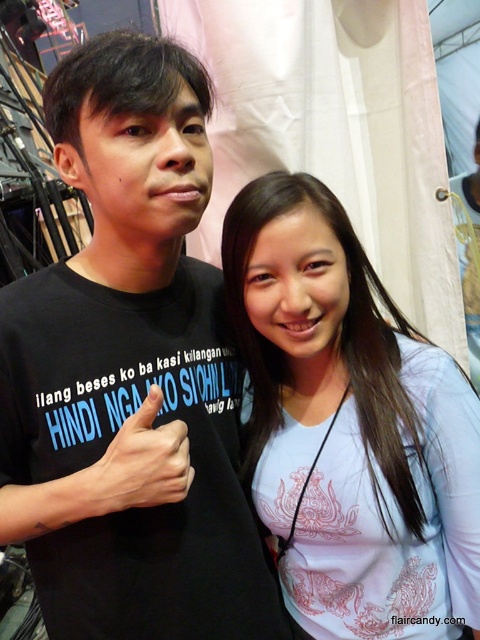
Question: Does black matte t-shirt at center appear on the left side of white matte shirt at center?

Choices:
 (A) yes
 (B) no

Answer: (A)

Question: Estimate the real-world distances between objects in this image. Which object is closer to the white matte shirt at center?

Choices:
 (A) black matte t-shirt at center
 (B) black matte hand at center

Answer: (A)

Question: Among these objects, which one is farthest from the camera?

Choices:
 (A) black matte t-shirt at center
 (B) black matte hand at center
 (C) white matte shirt at center

Answer: (C)

Question: From the image, what is the correct spatial relationship of black matte t-shirt at center in relation to white matte shirt at center?

Choices:
 (A) below
 (B) above

Answer: (B)

Question: Which object is farther from the camera taking this photo?

Choices:
 (A) black matte t-shirt at center
 (B) white matte shirt at center
 (C) black matte hand at center

Answer: (B)

Question: Is white matte shirt at center bigger than black matte hand at center?

Choices:
 (A) yes
 (B) no

Answer: (A)